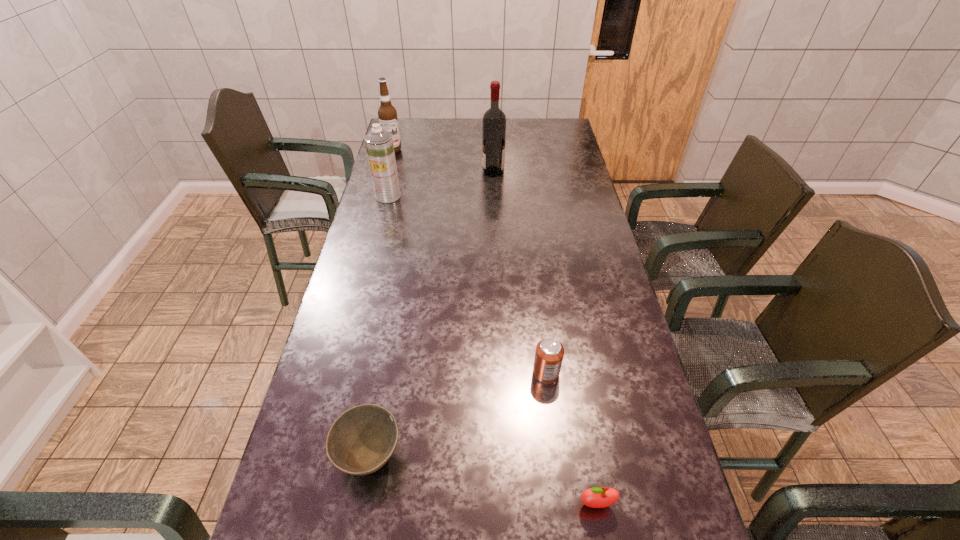
At what (x,y) coordinates should I click in order to perform the action: click on the right alcohol. Please return your answer as a coordinate pair (x, y). The height and width of the screenshot is (540, 960). Looking at the image, I should click on (494, 120).

Image resolution: width=960 pixels, height=540 pixels. In order to click on the nearer alcohol in this screenshot , I will do `click(494, 120)`.

This screenshot has height=540, width=960. In order to click on the shorter alcohol in this screenshot , I will do `click(387, 114)`.

Identify the location of the left alcohol. Image resolution: width=960 pixels, height=540 pixels. (387, 114).

The image size is (960, 540). What are the coordinates of `the third farthest object` in the screenshot? It's located at (379, 145).

The image size is (960, 540). In order to click on the third nearest object in this screenshot , I will do `click(549, 353)`.

Where is `the second nearest object`? the second nearest object is located at coordinates (362, 439).

Image resolution: width=960 pixels, height=540 pixels. In order to click on the nearest object in this screenshot , I will do `click(597, 497)`.

Identify the location of vacant space located 0.390m on the front and back of the third object from right to left. (389, 172).

You are a GUI agent. You are given a task and a screenshot of the screen. Output one action in this format:
    pyautogui.click(x=<x>, y=<y>)
    Task: Click on the vacant space located 0.140m on the front and back of the third object from right to left
    
    Given the screenshot: What is the action you would take?
    pyautogui.click(x=448, y=172)